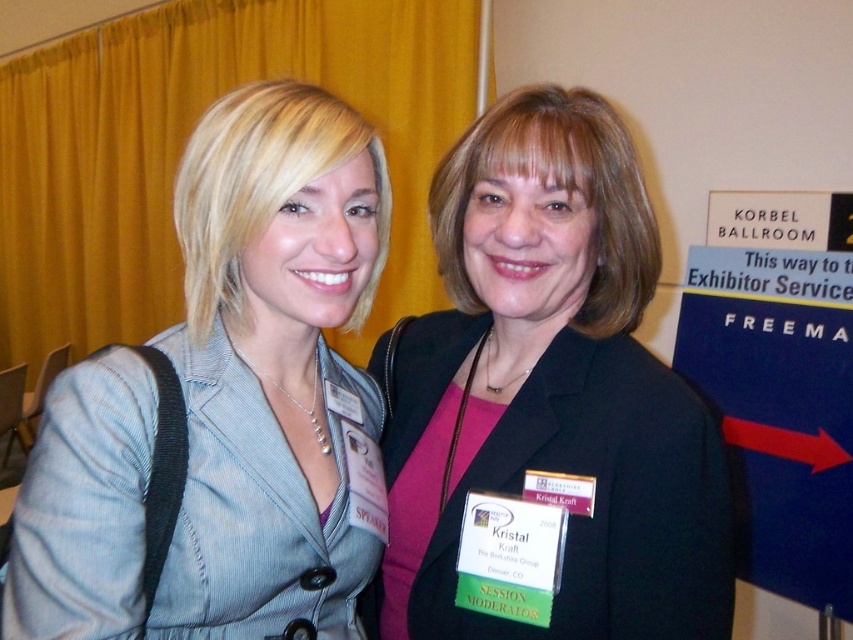
Who is higher up, denim jacket at center or matte black blazer at center?

denim jacket at center

Does denim jacket at center have a lesser width compared to matte black blazer at center?

Yes.

What do you see at coordinates (228, 403) in the screenshot?
I see `denim jacket at center` at bounding box center [228, 403].

The width and height of the screenshot is (853, 640). In order to click on denim jacket at center in this screenshot , I will do `click(228, 403)`.